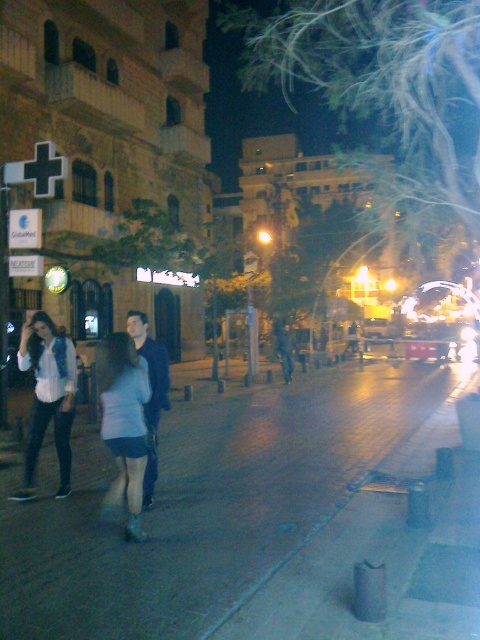
You are standing in the middle of the pedestrian area and want to walk towards the point that is closer to you. Which point should you head towards, point (54, 620) or point (108, 417)?

You should head towards point (54, 620) because it is closer to the viewer than point (108, 417).

You are a delivery person trying to navigate through the nighttime urban area. You need to place a large package on the smooth concrete sidewalk at lower center and the denim jacket at left. Which surface can accommodate the package better?

The smooth concrete sidewalk at lower center is larger in size than the denim jacket at left, so the package can be placed on the smooth concrete sidewalk at lower center.

You are standing on the smooth concrete sidewalk at lower center and want to greet the person wearing the denim jacket at left. Which direction should you move to reach them?

Since the smooth concrete sidewalk at lower center is to the right of the denim jacket at left, you should move to your left to reach the person wearing the denim jacket at left.